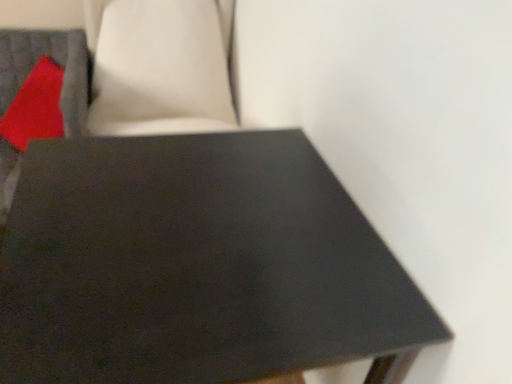
Question: Is matte red pillow at upper left smaller than matte black table at center?

Choices:
 (A) yes
 (B) no

Answer: (A)

Question: Is matte red pillow at upper left turned away from matte black table at center?

Choices:
 (A) no
 (B) yes

Answer: (A)

Question: Does matte red pillow at upper left lie behind matte black table at center?

Choices:
 (A) no
 (B) yes

Answer: (B)

Question: From the image's perspective, does matte red pillow at upper left appear lower than matte black table at center?

Choices:
 (A) no
 (B) yes

Answer: (A)

Question: Does matte red pillow at upper left come in front of matte black table at center?

Choices:
 (A) no
 (B) yes

Answer: (A)

Question: Does matte red pillow at upper left touch matte black table at center?

Choices:
 (A) yes
 (B) no

Answer: (B)

Question: Is matte black table at center next to matte red pillow at upper left?

Choices:
 (A) yes
 (B) no

Answer: (B)

Question: From a real-world perspective, does matte black table at center stand above matte red pillow at upper left?

Choices:
 (A) yes
 (B) no

Answer: (B)

Question: Does matte black table at center appear on the left side of matte red pillow at upper left?

Choices:
 (A) yes
 (B) no

Answer: (B)

Question: From the image's perspective, is matte black table at center beneath matte red pillow at upper left?

Choices:
 (A) yes
 (B) no

Answer: (A)

Question: From a real-world perspective, is matte black table at center positioned under matte red pillow at upper left based on gravity?

Choices:
 (A) yes
 (B) no

Answer: (A)

Question: Does matte black table at center have a smaller size compared to matte red pillow at upper left?

Choices:
 (A) no
 (B) yes

Answer: (A)

Question: Considering the positions of matte black table at center and matte red pillow at upper left in the image, is matte black table at center taller or shorter than matte red pillow at upper left?

Choices:
 (A) tall
 (B) short

Answer: (A)